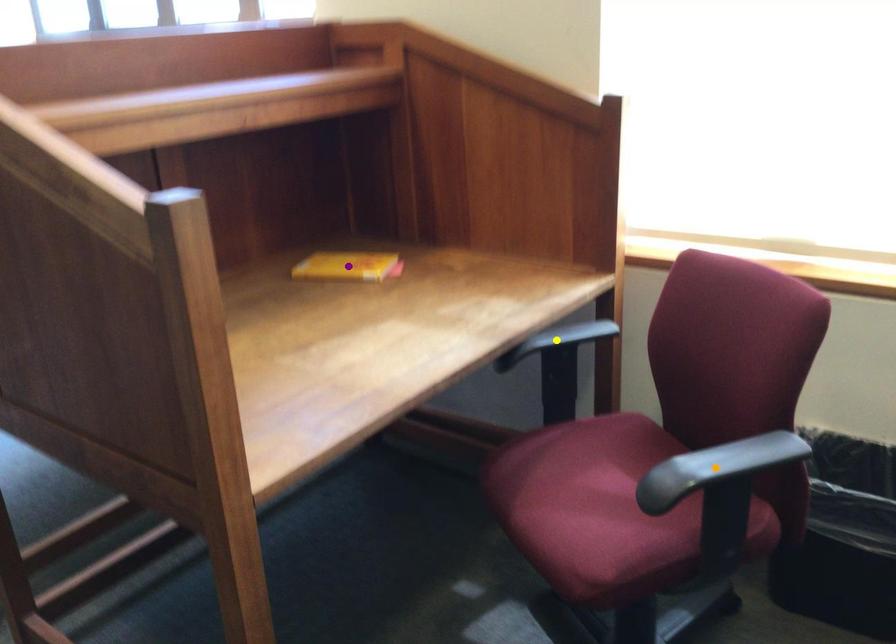
Order these from farthest to nearest:
orange point | purple point | yellow point

purple point
yellow point
orange point